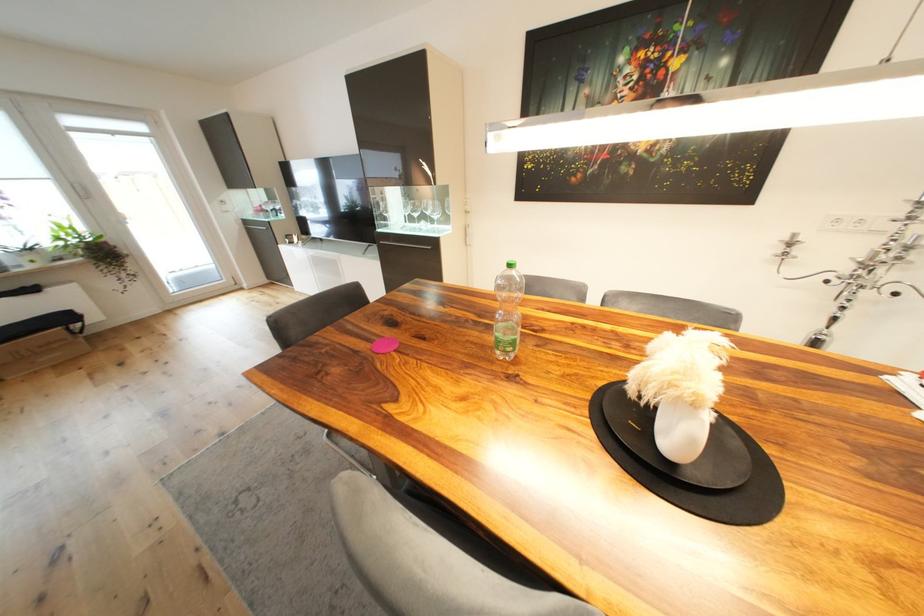
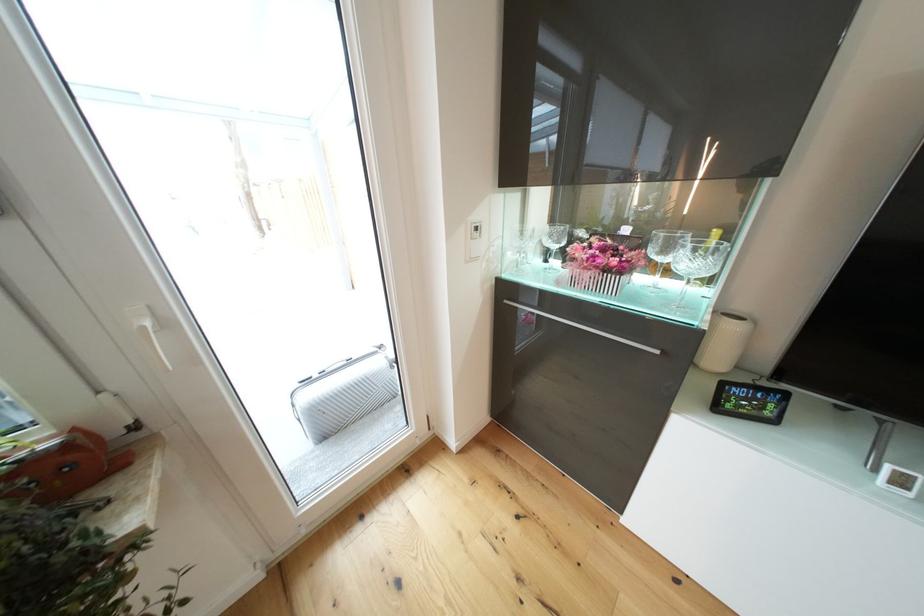
The images are taken continuously from a first-person perspective. In which direction are you moving?

The cameraman walked toward left, forward.